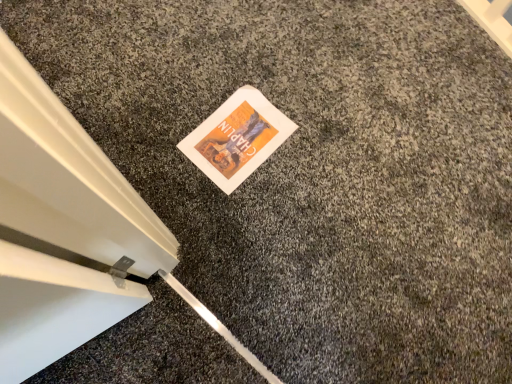
The height and width of the screenshot is (384, 512). I want to click on vacant area on the back side of white paper at center, so click(243, 65).